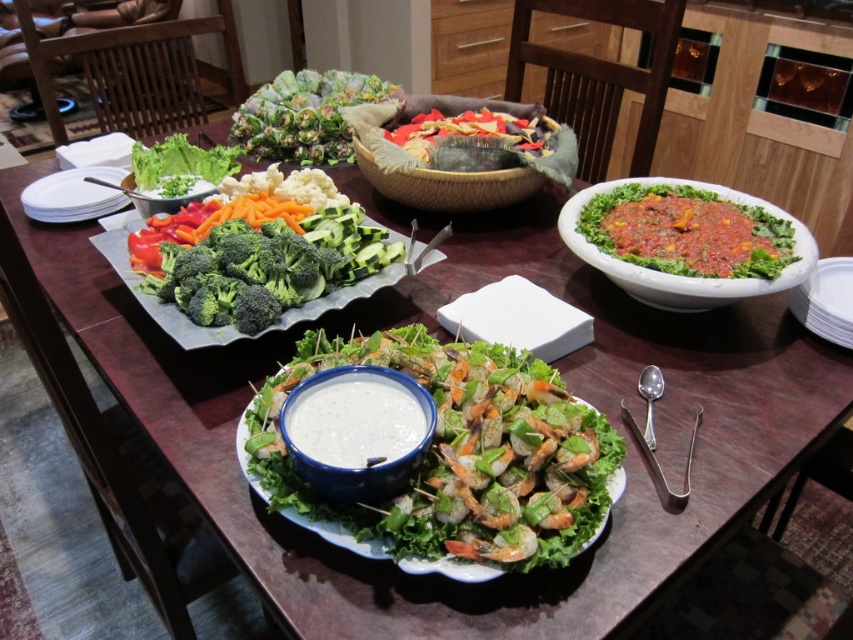
You are a guest at the buffet and want to serve yourself a salad. The white matte bowl at center has dip, while the green leafy salad at upper left is the main salad. Which container should you use to hold your salad, and why?

You should use the green leafy salad at upper left because the white matte bowl at center is smaller than the green leafy salad at upper left, making the salad container larger and more suitable for holding the salad.